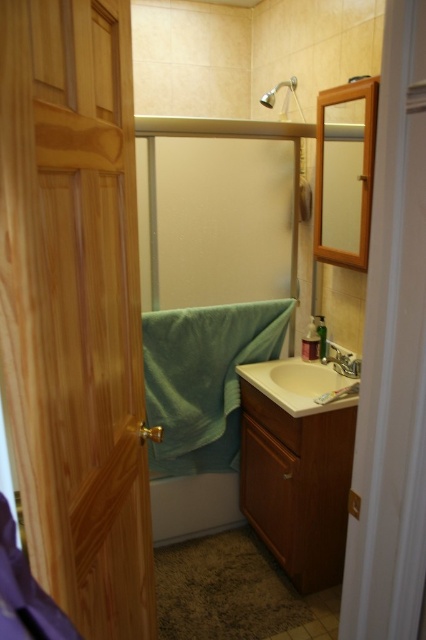
Question: Which point is closer to the camera?

Choices:
 (A) wooden framed mirror at upper right
 (B) matte silver shower head at upper center

Answer: (A)

Question: Can you confirm if green cotton towel at center is wider than matte silver faucet at sink right?

Choices:
 (A) no
 (B) yes

Answer: (B)

Question: Considering the real-world distances, which object is closest to the matte silver faucet at sink right?

Choices:
 (A) beige matte sink at center
 (B) green cotton towel at center

Answer: (A)

Question: Does white glossy bathtub at lower center appear over matte silver shower head at upper center?

Choices:
 (A) no
 (B) yes

Answer: (A)

Question: Among these objects, which one is nearest to the camera?

Choices:
 (A) white glossy bathtub at lower center
 (B) wooden door at left
 (C) matte silver shower head at upper center
 (D) beige matte sink at center

Answer: (B)

Question: Is beige matte sink at center above matte silver shower head at upper center?

Choices:
 (A) yes
 (B) no

Answer: (B)